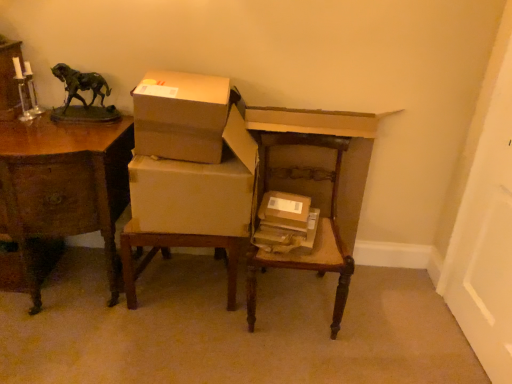
Locate an element on the screen. free space below wooden desk at left (from a real-world perspective) is located at coordinates (74, 283).